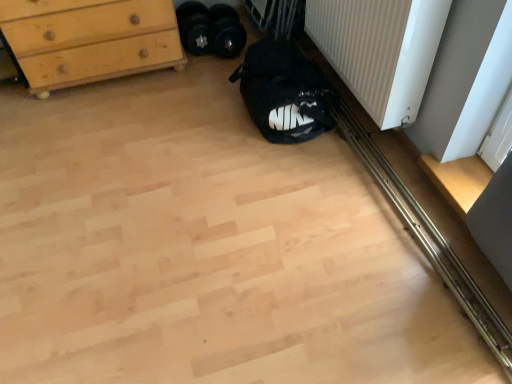
Question: Considering the relative positions of black fabric sleeping bag at lower center and black rubber weights at center, positioned as the first footwear in left-to-right order, in the image provided, is black fabric sleeping bag at lower center to the right of black rubber weights at center, positioned as the first footwear in left-to-right order, from the viewer's perspective?

Choices:
 (A) no
 (B) yes

Answer: (B)

Question: Is black fabric sleeping bag at lower center positioned with its back to black rubber weights at center, positioned as the first footwear in left-to-right order?

Choices:
 (A) yes
 (B) no

Answer: (A)

Question: Is black fabric sleeping bag at lower center facing towards black rubber weights at center, marked as the 2th footwear in a right-to-left arrangement?

Choices:
 (A) yes
 (B) no

Answer: (B)

Question: From a real-world perspective, is black fabric sleeping bag at lower center located higher than black rubber weights at center, positioned as the first footwear in left-to-right order?

Choices:
 (A) yes
 (B) no

Answer: (A)

Question: From the image's perspective, is black fabric sleeping bag at lower center under black rubber weights at center, marked as the 2th footwear in a right-to-left arrangement?

Choices:
 (A) yes
 (B) no

Answer: (A)

Question: Considering the positions of light wood chest of drawers at upper left and black fabric shoe at center, which appears as the 2th footwear when viewed from the left, in the image, is light wood chest of drawers at upper left taller or shorter than black fabric shoe at center, which appears as the 2th footwear when viewed from the left,?

Choices:
 (A) short
 (B) tall

Answer: (B)

Question: From the image's perspective, is light wood chest of drawers at upper left positioned above or below black fabric shoe at center, which appears as the 2th footwear when viewed from the left?

Choices:
 (A) below
 (B) above

Answer: (A)

Question: From a real-world perspective, is light wood chest of drawers at upper left positioned above or below black fabric shoe at center, which appears as the 1th footwear when viewed from the right?

Choices:
 (A) above
 (B) below

Answer: (A)

Question: Choose the correct answer: Is light wood chest of drawers at upper left inside black fabric shoe at center, which appears as the 1th footwear when viewed from the right, or outside it?

Choices:
 (A) inside
 (B) outside

Answer: (B)

Question: Considering the positions of point (39, 61) and point (203, 51), is point (39, 61) closer or farther from the camera than point (203, 51)?

Choices:
 (A) farther
 (B) closer

Answer: (B)

Question: Is light wood chest of drawers at upper left taller or shorter than black rubber weights at center, marked as the 2th footwear in a right-to-left arrangement?

Choices:
 (A) tall
 (B) short

Answer: (A)

Question: Considering their positions, is light wood chest of drawers at upper left located in front of or behind black rubber weights at center, positioned as the first footwear in left-to-right order?

Choices:
 (A) front
 (B) behind

Answer: (A)

Question: Considering the relative positions of light wood chest of drawers at upper left and black rubber weights at center, marked as the 2th footwear in a right-to-left arrangement, in the image provided, is light wood chest of drawers at upper left to the left or to the right of black rubber weights at center, marked as the 2th footwear in a right-to-left arrangement,?

Choices:
 (A) right
 (B) left

Answer: (B)

Question: From a real-world perspective, is black rubber weights at center, positioned as the first footwear in left-to-right order, physically located above or below black fabric sleeping bag at lower center?

Choices:
 (A) below
 (B) above

Answer: (A)

Question: Would you say black rubber weights at center, marked as the 2th footwear in a right-to-left arrangement, is inside or outside black fabric sleeping bag at lower center?

Choices:
 (A) inside
 (B) outside

Answer: (B)